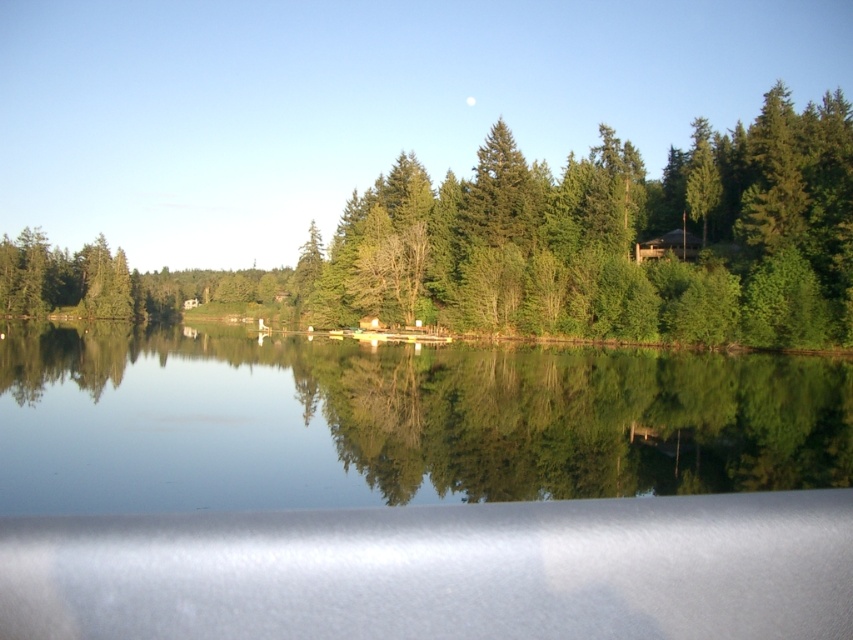
Who is positioned more to the right, green reflective water at center or transparent glass car window at lower center?

Positioned to the right is transparent glass car window at lower center.

Is green reflective water at center closer to camera compared to transparent glass car window at lower center?

No, it is behind transparent glass car window at lower center.

Where is `green reflective water at center`? green reflective water at center is located at coordinates (395, 420).

You are a GUI agent. You are given a task and a screenshot of the screen. Output one action in this format:
    pyautogui.click(x=<x>, y=<y>)
    Task: Click on the green reflective water at center
    This screenshot has height=640, width=853.
    Given the screenshot: What is the action you would take?
    pyautogui.click(x=395, y=420)

Does green reflective water at center have a lesser height compared to brown wooden cabin at upper right?

Correct, green reflective water at center is not as tall as brown wooden cabin at upper right.

Which is behind, point (444, 378) or point (656, 253)?

The point (656, 253) is more distant.

The height and width of the screenshot is (640, 853). I want to click on green reflective water at center, so click(x=395, y=420).

Where is `green reflective water at center`? green reflective water at center is located at coordinates [395, 420].

Does point (699, 150) come farther from viewer compared to point (674, 237)?

Yes, point (699, 150) is farther from viewer.

Is green matte forest at center to the left of brown wooden cabin at upper right from the viewer's perspective?

No, green matte forest at center is not to the left of brown wooden cabin at upper right.

I want to click on green matte forest at center, so click(x=547, y=244).